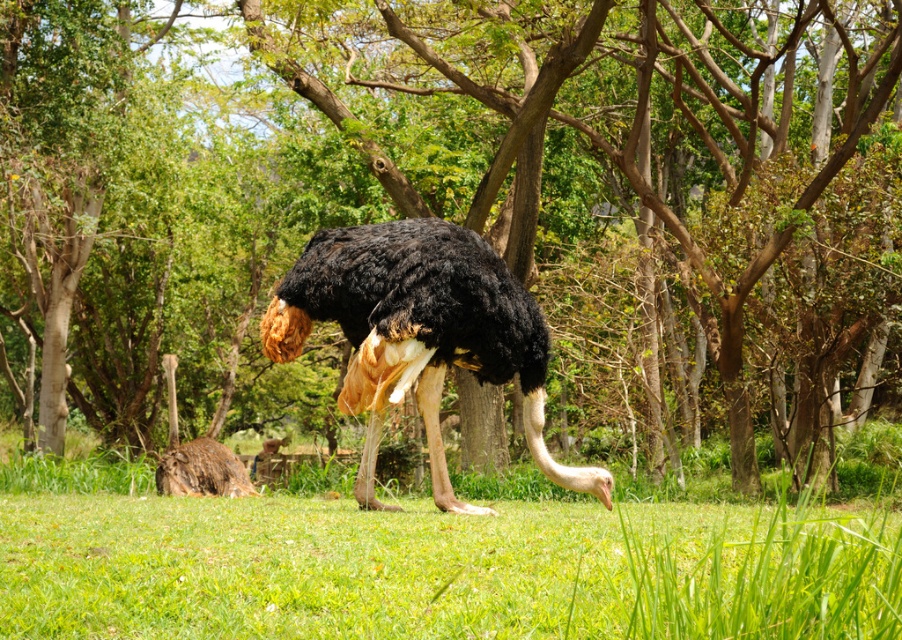
You are a wildlife photographer aiming to capture a photo of the black feathered ostrich at center and the brown feathered ostrich at lower left. If you want to ensure both are in frame, which ostrich should you position closer to the camera to avoid cropping?

To ensure both the black feathered ostrich at center and the brown feathered ostrich at lower left are in frame, you should position the brown feathered ostrich at lower left closer to the camera. This is because the brown feathered ostrich at lower left is wider than the black feathered ostrich at center, so it requires more space in the frame.

You are standing at the point labeled as point (442, 568) in the image. Looking around, you see the green grassy area at center. Can you determine what is directly beneath your feet?

The point (442, 568) indicates green grassy at center, so the area directly beneath your feet is green grassy at center.

You are a photographer positioned at the center of the image. You want to take a photo of the black feathered ostrich at center. What are the 2D coordinates of the ostrich in the image?

The 2D coordinates of the black feathered ostrich at center are at point [419,333].